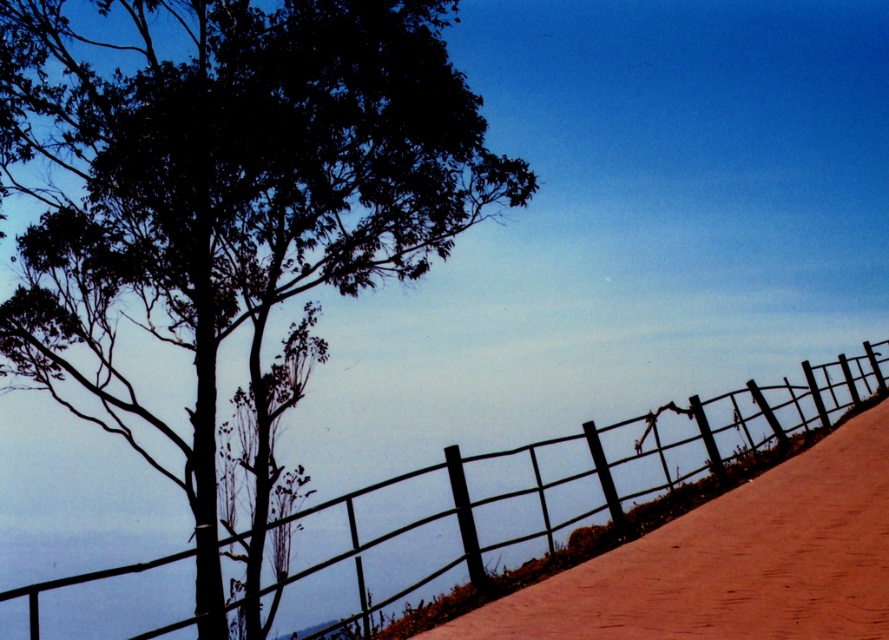
Question: Is brown textured dirt track at center-right to the left of metallic wire fence at upper center from the viewer's perspective?

Choices:
 (A) no
 (B) yes

Answer: (A)

Question: Is dark green leafy tree at upper left smaller than metallic wire fence at upper center?

Choices:
 (A) no
 (B) yes

Answer: (B)

Question: Considering the relative positions of dark green leafy tree at upper left and brown textured dirt track at center-right in the image provided, where is dark green leafy tree at upper left located with respect to brown textured dirt track at center-right?

Choices:
 (A) left
 (B) right

Answer: (A)

Question: Estimate the real-world distances between objects in this image. Which object is farther from the metallic wire fence at upper center?

Choices:
 (A) dark green leafy tree at upper left
 (B) brown textured dirt track at center-right

Answer: (A)

Question: Which object is farther from the camera taking this photo?

Choices:
 (A) brown textured dirt track at center-right
 (B) metallic wire fence at upper center
 (C) dark green leafy tree at upper left

Answer: (C)

Question: Which is farther from the dark green leafy tree at upper left?

Choices:
 (A) brown textured dirt track at center-right
 (B) metallic wire fence at upper center

Answer: (A)